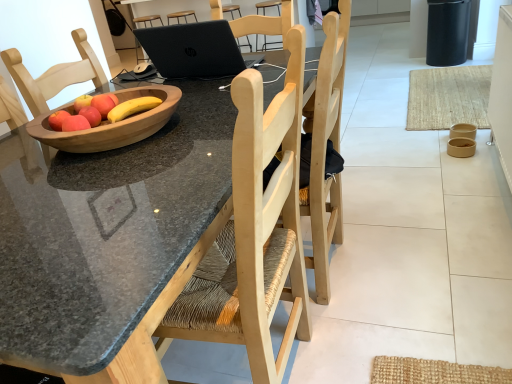
Where is `free space in front of wooden bowl of fruit at center`? Image resolution: width=512 pixels, height=384 pixels. free space in front of wooden bowl of fruit at center is located at coordinates (122, 156).